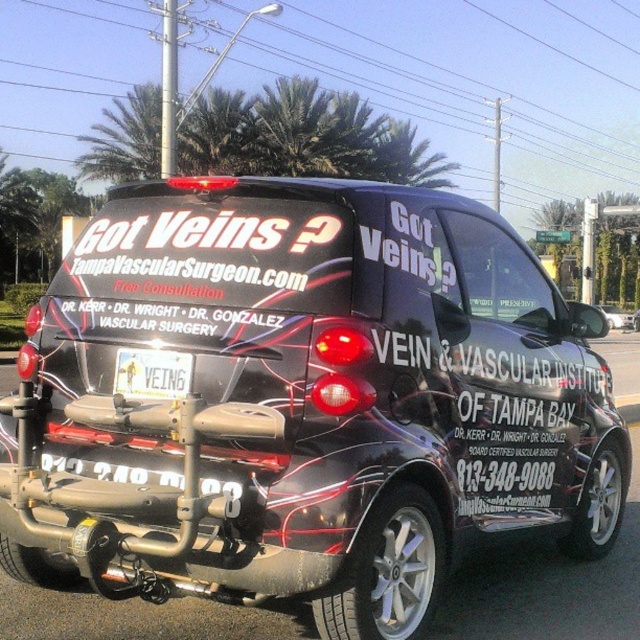
You are a pedestrian standing on the sidewalk looking at the black matte car at center. There is a white plastic license plate at rear attached to it. Which object is nearer to you?

The white plastic license plate at rear is closer to the viewer than the black matte car at center.

You are a delivery person who needs to park a delivery van that is 6 meters long. You see the black matte vehicle at center and the glossy black car at center in the parking lot. Which vehicle takes up more space in the parking spot?

The black matte vehicle at center has a larger width than the glossy black car at center, so it takes up more space in the parking spot.